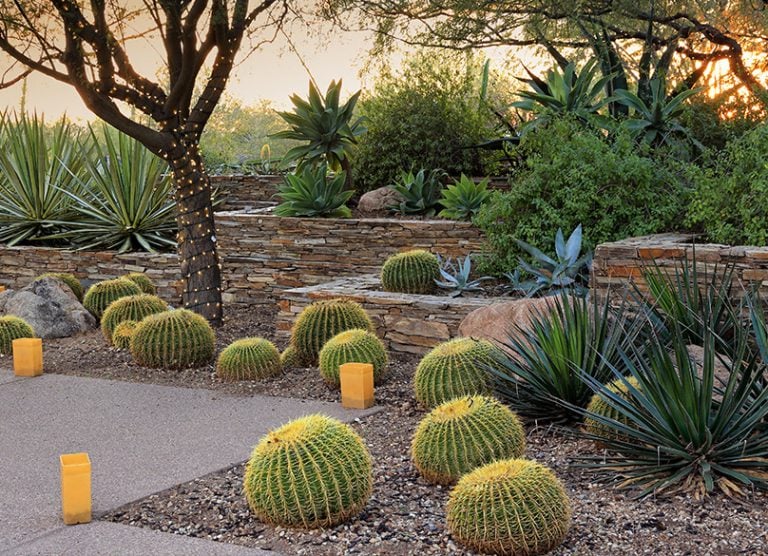
You are a GUI agent. You are given a task and a screenshot of the screen. Output one action in this format:
    pyautogui.click(x=<x>, y=<y>)
    Task: Click on the walk way lights
    
    Given the screenshot: What is the action you would take?
    tap(71, 498), tap(356, 374), tap(34, 355)